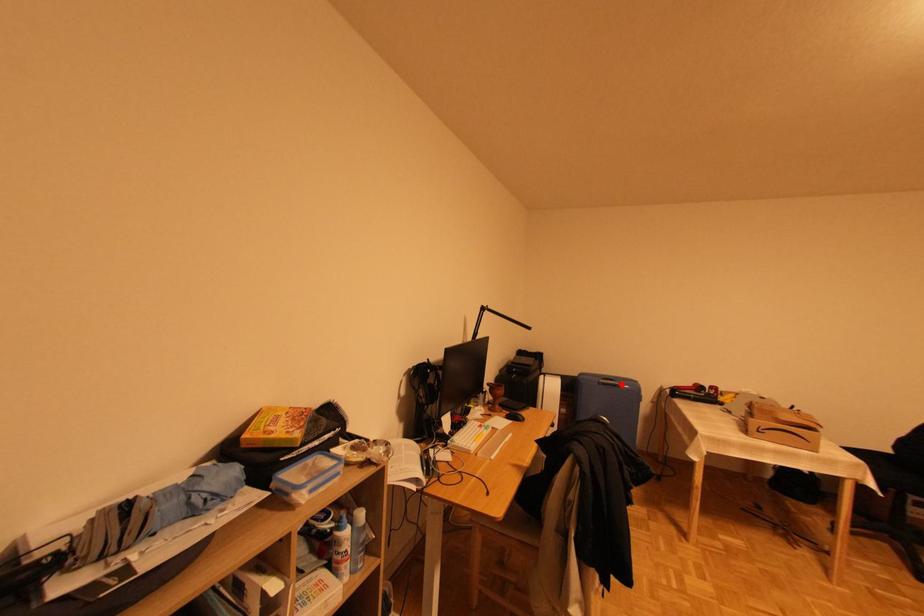
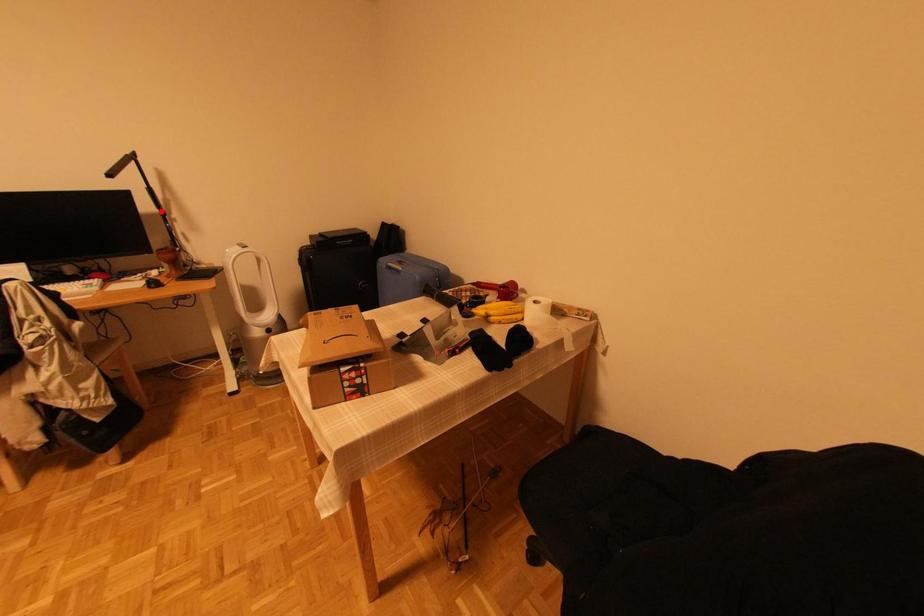
I am providing you with two images of the same scene from different viewpoints. A red point is marked on the first image and another point is marked on the second image. Does the point marked in image1 correspond to the same location as the one in image2?

No